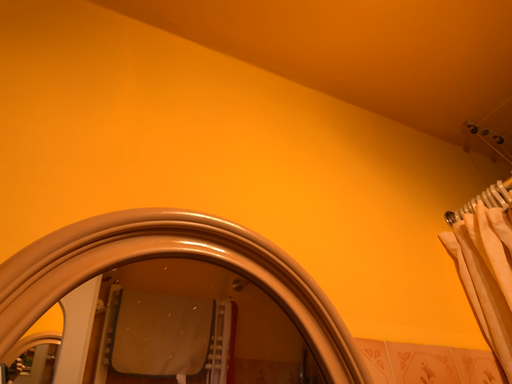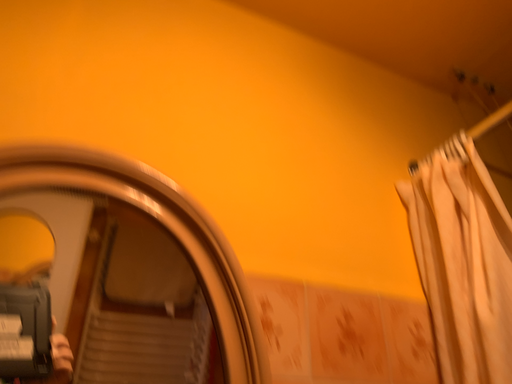
Question: Which way did the camera rotate in the video?

Choices:
 (A) rotated downward
 (B) rotated upward

Answer: (A)